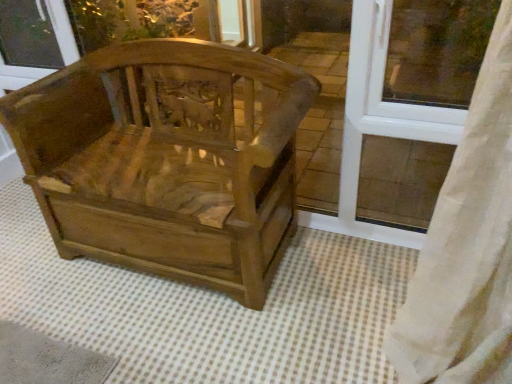
Where is `white plastic window frame at upper right`? white plastic window frame at upper right is located at coordinates (382, 86).

The width and height of the screenshot is (512, 384). I want to click on transparent glass window screen at upper left, so point(28,35).

Is white plastic window frame at upper right next to wooden carved chair at center?

No, white plastic window frame at upper right is not in contact with wooden carved chair at center.

Which object is further away from the camera taking this photo, white plastic window frame at upper right or wooden carved chair at center?

white plastic window frame at upper right.

How different are the orientations of white plastic window frame at upper right and wooden carved chair at center in degrees?

The facing directions of white plastic window frame at upper right and wooden carved chair at center are 1.57 degrees apart.

From a real-world perspective, is white plastic window frame at upper right physically below wooden carved chair at center?

Actually, white plastic window frame at upper right is physically above wooden carved chair at center in the real world.

From the image's perspective, is wooden carved chair at center above white plastic window frame at upper right?

No.

Is wooden carved chair at center oriented towards white plastic window frame at upper right?

No, wooden carved chair at center does not turn towards white plastic window frame at upper right.

Would you say wooden carved chair at center contains white plastic window frame at upper right?

Definitely not — white plastic window frame at upper right is not inside wooden carved chair at center.

Which of these two, wooden carved chair at center or white plastic window frame at upper right, stands shorter?

white plastic window frame at upper right is shorter.

Is transparent glass window screen at upper left aimed at white plastic window frame at upper right?

No, transparent glass window screen at upper left is not oriented towards white plastic window frame at upper right.

From a real-world perspective, is transparent glass window screen at upper left physically located above or below white plastic window frame at upper right?

Clearly, from a real-world perspective, transparent glass window screen at upper left is below white plastic window frame at upper right.

Is transparent glass window screen at upper left spatially inside white plastic window frame at upper right, or outside of it?

transparent glass window screen at upper left is not inside white plastic window frame at upper right, it's outside.

Can you confirm if transparent glass window screen at upper left is taller than wooden carved chair at center?

In fact, transparent glass window screen at upper left may be shorter than wooden carved chair at center.

Does point (48, 15) come behind point (166, 39)?

Yes, point (48, 15) is farther from viewer.

How many degrees apart are the facing directions of transparent glass window screen at upper left and wooden carved chair at center?

They differ by 1.57 degrees in their facing directions.

Is transparent glass window screen at upper left in front of or behind wooden carved chair at center in the image?

Clearly, transparent glass window screen at upper left is behind wooden carved chair at center.

Which of these two, wooden carved chair at center or transparent glass window screen at upper left, is wider?

wooden carved chair at center is wider.

Is wooden carved chair at center facing away from transparent glass window screen at upper left?

That's not correct — wooden carved chair at center is not looking away from transparent glass window screen at upper left.

Looking at this image, can you tell me how much wooden carved chair at center and transparent glass window screen at upper left differ in facing direction?

The angle between the facing direction of wooden carved chair at center and the facing direction of transparent glass window screen at upper left is 1.57 degrees.

From a real-world perspective, which is physically above, wooden carved chair at center or transparent glass window screen at upper left?

transparent glass window screen at upper left, from a real-world perspective.

Which is more to the left, white plastic window frame at upper right or transparent glass window screen at upper left?

transparent glass window screen at upper left.

Which point is more forward, (x=353, y=51) or (x=24, y=47)?

Point (x=353, y=51)

What's the angular difference between white plastic window frame at upper right and transparent glass window screen at upper left's facing directions?

0.0019 degrees.

I want to click on window frame lying behind the wooden carved chair at center, so click(x=382, y=86).

Identify the location of window frame on the right side of wooden carved chair at center. The width and height of the screenshot is (512, 384). (382, 86).

Estimate the real-world distances between objects in this image. Which object is further from wooden carved chair at center, transparent glass window screen at upper left or white plastic window frame at upper right?

transparent glass window screen at upper left is further to wooden carved chair at center.

Looking at the image, which one is located closer to white plastic window frame at upper right, transparent glass window screen at upper left or wooden carved chair at center?

Among the two, wooden carved chair at center is located nearer to white plastic window frame at upper right.

Which object lies further to the anchor point white plastic window frame at upper right, wooden carved chair at center or transparent glass window screen at upper left?

Based on the image, transparent glass window screen at upper left appears to be further to white plastic window frame at upper right.

Estimate the real-world distances between objects in this image. Which object is further from transparent glass window screen at upper left, white plastic window frame at upper right or wooden carved chair at center?

white plastic window frame at upper right.

Estimate the real-world distances between objects in this image. Which object is further from wooden carved chair at center, white plastic window frame at upper right or transparent glass window screen at upper left?

transparent glass window screen at upper left is further to wooden carved chair at center.

Considering their positions, is wooden carved chair at center positioned further to transparent glass window screen at upper left than white plastic window frame at upper right?

white plastic window frame at upper right lies further to transparent glass window screen at upper left than the other object.

Image resolution: width=512 pixels, height=384 pixels. In order to click on chair located between transparent glass window screen at upper left and white plastic window frame at upper right in the left-right direction in this screenshot , I will do `click(167, 159)`.